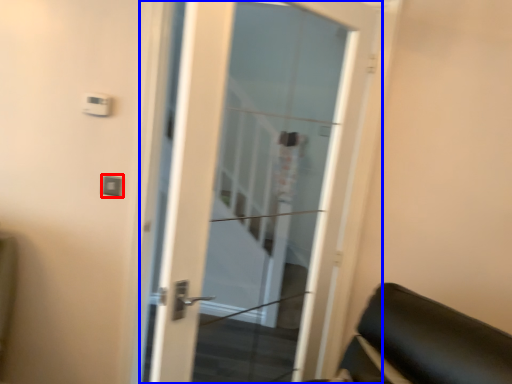
Question: Which of the following is the farthest to the observer, light switch (highlighted by a red box) or door (highlighted by a blue box)?

Choices:
 (A) light switch
 (B) door

Answer: (A)